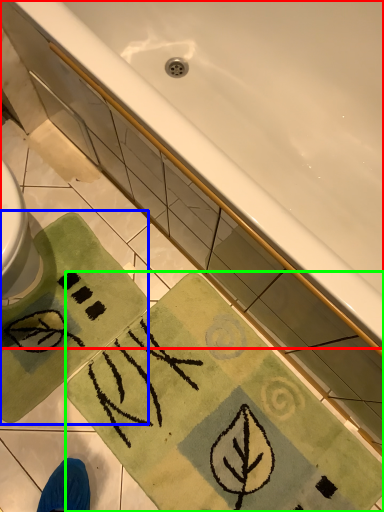
Question: Which object is the closest to the bathtub (highlighted by a red box)? Choose among these: beach towel (highlighted by a blue box) or beach towel (highlighted by a green box).

Choices:
 (A) beach towel
 (B) beach towel

Answer: (B)